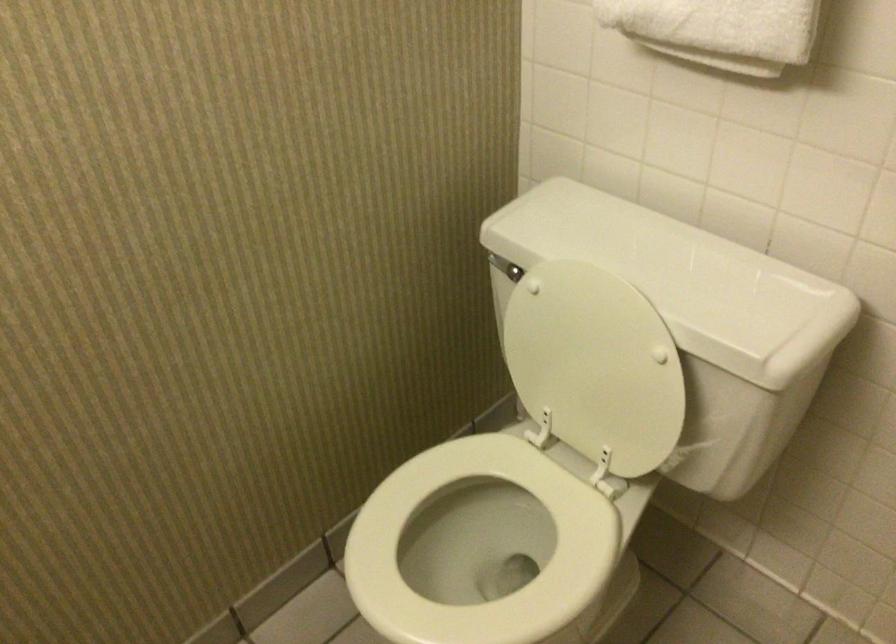
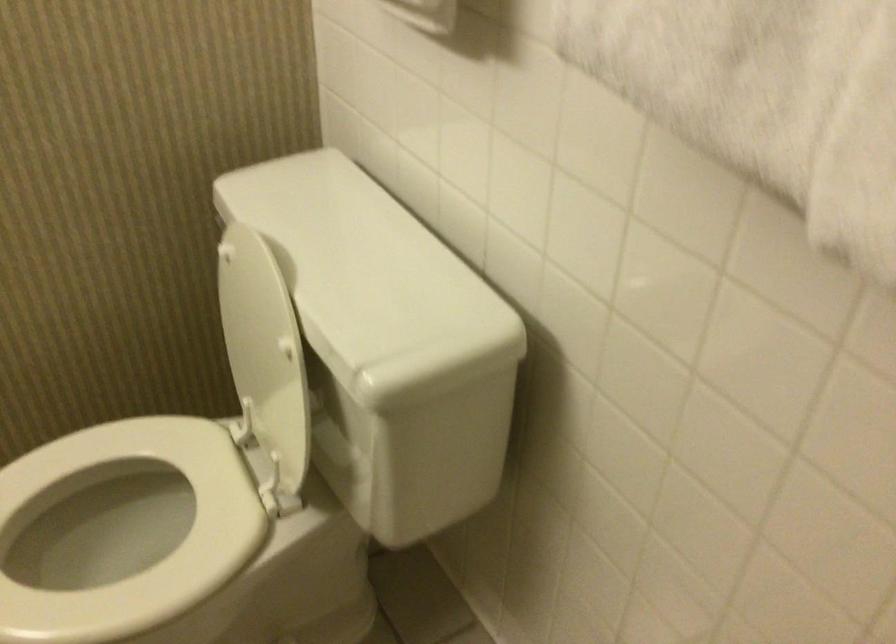
Where in the second image is the point corresponding to pixel 779 418 from the first image?

(411, 451)